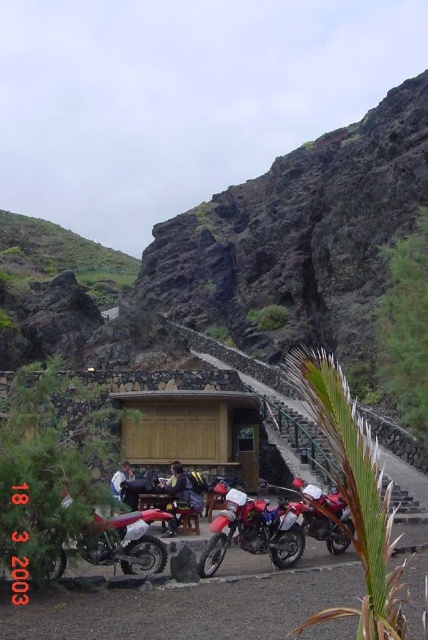
Question: Does red matte motorcycle at center lie behind light blue denim jacket at center?

Choices:
 (A) yes
 (B) no

Answer: (B)

Question: Which of the following is the farthest from the observer?

Choices:
 (A) (171, 486)
 (B) (303, 500)
 (C) (116, 499)

Answer: (A)

Question: From the image, what is the correct spatial relationship of matte red motorcycle at lower left in relation to dark blue jeans at center?

Choices:
 (A) left
 (B) right

Answer: (A)

Question: Which is farther from the light blue denim jacket at center?

Choices:
 (A) red matte motorcycle at center
 (B) metallic red motorcycle at center
 (C) matte red motorcycle at lower left
 (D) dark blue jeans at center

Answer: (B)

Question: Among these objects, which one is nearest to the camera?

Choices:
 (A) light blue denim jacket at center
 (B) metallic red motorcycle at center
 (C) dark blue jeans at center

Answer: (B)

Question: Can you confirm if red matte motorcycle at center is positioned to the left of metallic red motorcycle at center?

Choices:
 (A) no
 (B) yes

Answer: (B)